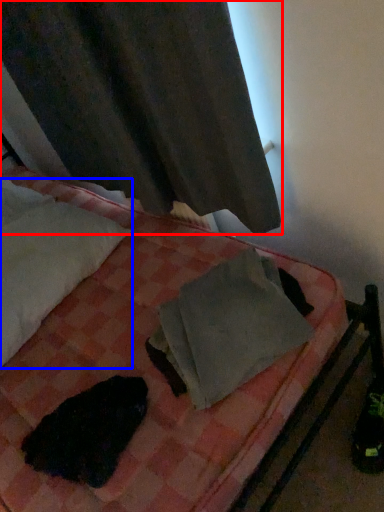
Question: Which object appears closest to the camera in this image, curtain (highlighted by a red box) or pillow (highlighted by a blue box)?

Choices:
 (A) curtain
 (B) pillow

Answer: (A)